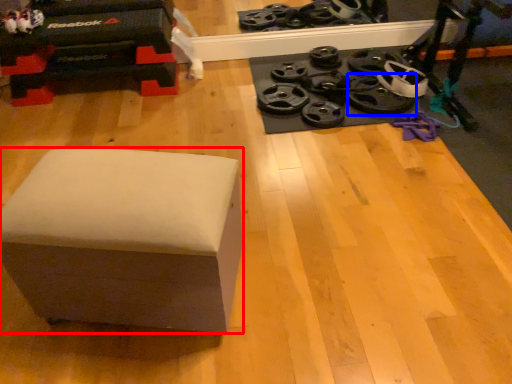
Question: Which of the following is the farthest to the observer, furniture (highlighted by a red box) or wheel (highlighted by a blue box)?

Choices:
 (A) furniture
 (B) wheel

Answer: (B)